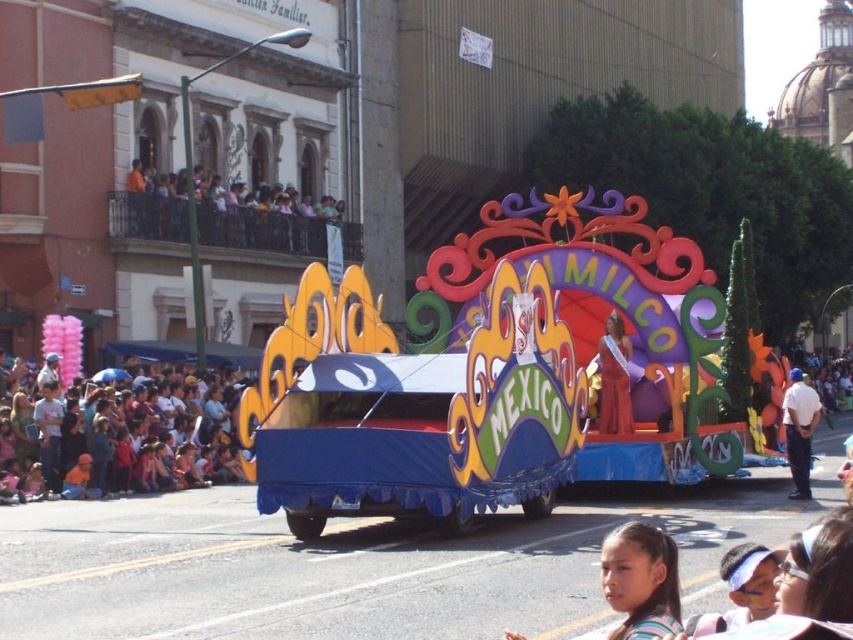
Question: Which point appears farthest from the camera in this image?

Choices:
 (A) (627, 632)
 (B) (602, 388)
 (C) (807, 433)

Answer: (B)

Question: Which object is positioned farthest from the matte white children at lower left?

Choices:
 (A) striped fabric headband at lower right
 (B) white uniform at center

Answer: (B)

Question: Can you confirm if matte white children at lower left is positioned above matte gold sash at center?

Choices:
 (A) no
 (B) yes

Answer: (A)

Question: Considering the relative positions of striped fabric headband at lower right and matte gold sash at center in the image provided, where is striped fabric headband at lower right located with respect to matte gold sash at center?

Choices:
 (A) below
 (B) above

Answer: (A)

Question: Estimate the real-world distances between objects in this image. Which object is closer to the striped fabric headband at lower right?

Choices:
 (A) matte gold sash at center
 (B) matte white children at lower left

Answer: (A)

Question: Can you confirm if matte white children at lower left is positioned below matte gold sash at center?

Choices:
 (A) no
 (B) yes

Answer: (B)